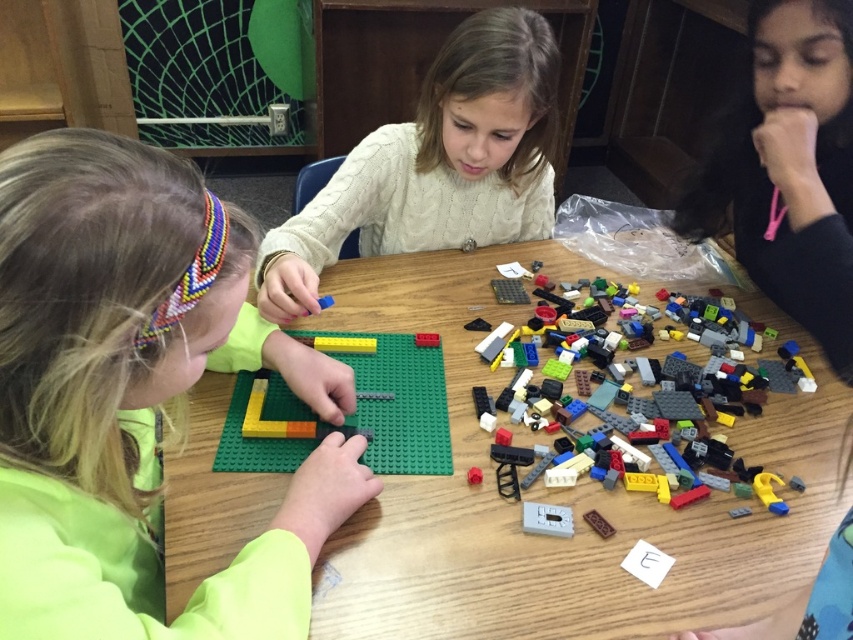
Between point (119, 420) and point (717, 417), which one is positioned in front?

Positioned in front is point (119, 420).

Identify the location of neon green shirt at upper left. (128, 400).

Is point (604, 556) behind point (770, 493)?

No.

Is wooden table at center thinner than multicolored plastic lego pieces at center?

No.

The height and width of the screenshot is (640, 853). In order to click on wooden table at center in this screenshot , I will do `click(560, 493)`.

Measure the distance between wooden table at center and matte black hair at upper right.

wooden table at center is 12.89 inches away from matte black hair at upper right.

Consider the image. Is wooden table at center wider than matte black hair at upper right?

Yes, wooden table at center is wider than matte black hair at upper right.

Locate an element on the screen. The image size is (853, 640). wooden table at center is located at coordinates (560, 493).

What are the coordinates of `wooden table at center` in the screenshot? It's located at (560, 493).